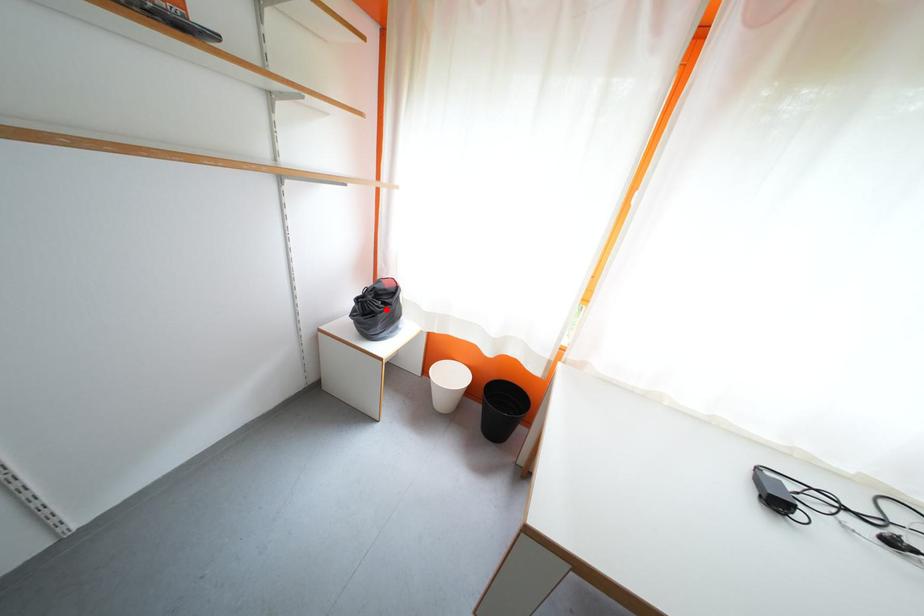
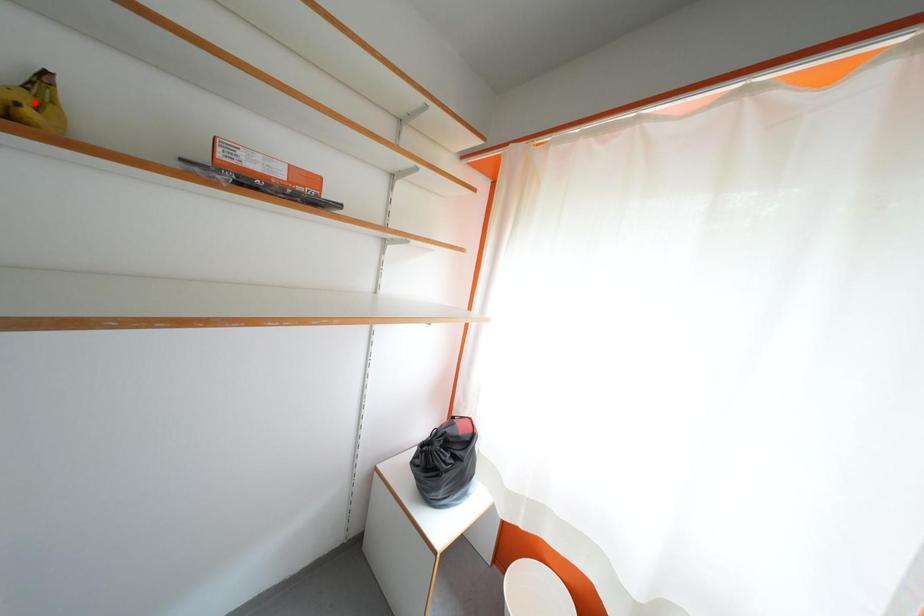
I am providing you with two images of the same scene from different viewpoints. A red point is marked on the first image and another point is marked on the second image. Is the red point in image1 aligned with the point shown in image2?

No